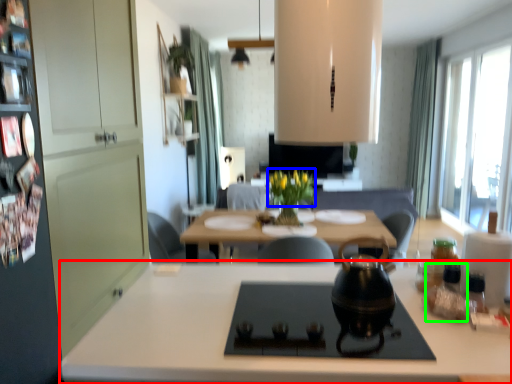
Question: Estimate the real-world distances between objects in this image. Which object is closer to countertop (highlighted by a red box), flower (highlighted by a blue box) or bottle (highlighted by a green box)?

Choices:
 (A) flower
 (B) bottle

Answer: (B)